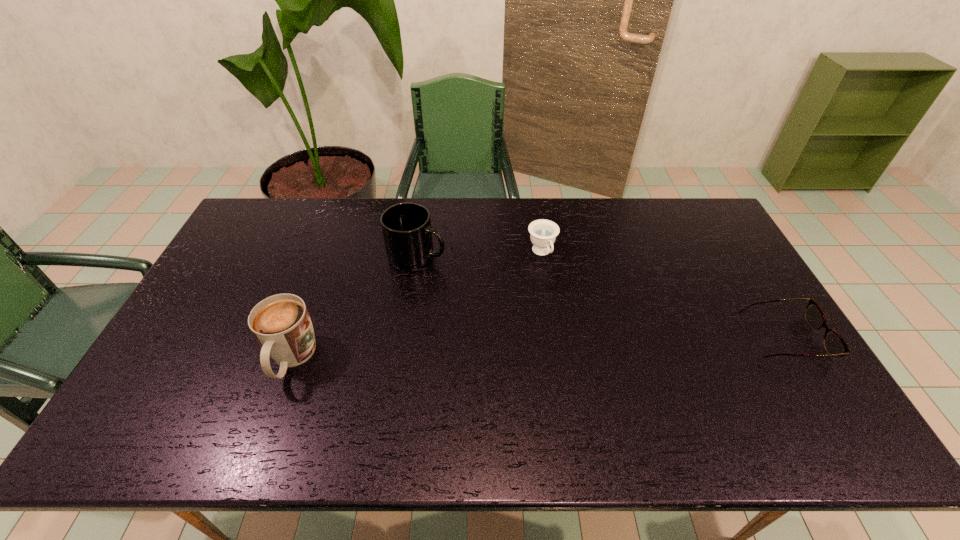
Identify the location of empty space between the rightmost object and the second object from right to left. Image resolution: width=960 pixels, height=540 pixels. (662, 295).

The width and height of the screenshot is (960, 540). Identify the location of free space between the farther mug and the rightmost object. (600, 297).

This screenshot has height=540, width=960. What are the coordinates of `free space between the left mug and the third object from left to right` in the screenshot? It's located at (417, 306).

Locate an element on the screen. vacant area that lies between the left mug and the third object from left to right is located at coordinates (417, 306).

Where is `free space between the third object from left to right and the farther mug`? free space between the third object from left to right and the farther mug is located at coordinates (480, 254).

The width and height of the screenshot is (960, 540). What are the coordinates of `unoccupied position between the rightmost object and the third object from left to right` in the screenshot? It's located at (662, 295).

Where is `free space between the leftmost object and the spectacles`? free space between the leftmost object and the spectacles is located at coordinates (537, 348).

Where is `free space between the rightmost object and the second object from right to left`? Image resolution: width=960 pixels, height=540 pixels. free space between the rightmost object and the second object from right to left is located at coordinates (662, 295).

You are a GUI agent. You are given a task and a screenshot of the screen. Output one action in this format:
    pyautogui.click(x=<x>, y=<y>)
    Task: Click on the vacant point located between the leftmost object and the spectacles
    
    Given the screenshot: What is the action you would take?
    pyautogui.click(x=537, y=348)

This screenshot has height=540, width=960. In order to click on free space that is in between the rightmost object and the teacup in this screenshot , I will do `click(662, 295)`.